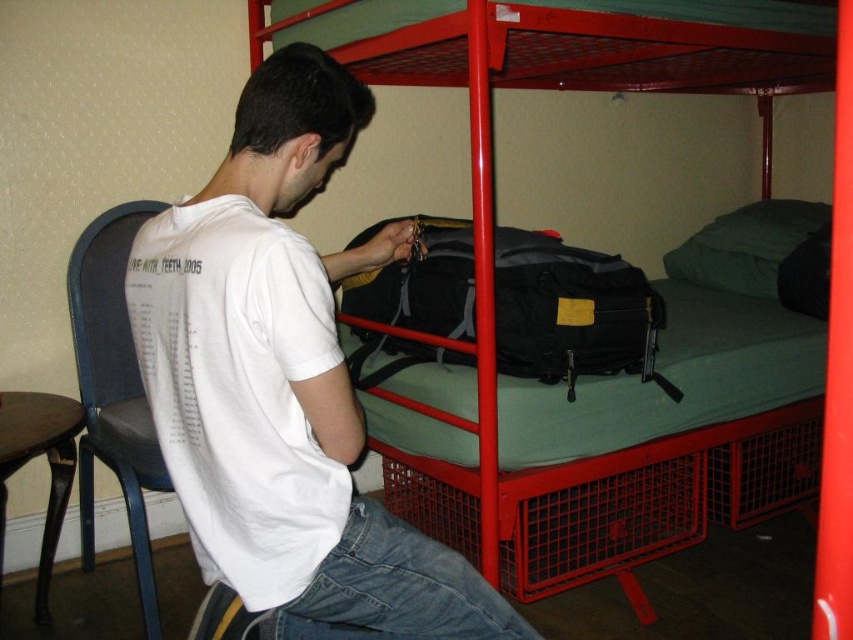
Question: Is the position of white cotton t-shirt at center less distant than that of brown wood stool at lower left?

Choices:
 (A) yes
 (B) no

Answer: (A)

Question: Which point appears closest to the camera in this image?

Choices:
 (A) (552, 570)
 (B) (64, 451)

Answer: (B)

Question: Which object is closer to the camera taking this photo?

Choices:
 (A) white cotton t-shirt at center
 (B) black fabric backpack at center

Answer: (A)

Question: Can you confirm if black fabric backpack at center is bigger than brown wood stool at lower left?

Choices:
 (A) yes
 (B) no

Answer: (A)

Question: Which is nearer to the white cotton t-shirt at center?

Choices:
 (A) brown wood stool at lower left
 (B) black fabric backpack at center

Answer: (B)

Question: Can you confirm if white cotton t-shirt at center is positioned to the left of black fabric backpack at center?

Choices:
 (A) no
 (B) yes

Answer: (B)